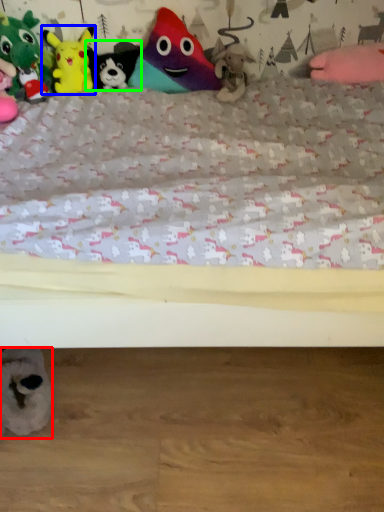
Question: Based on their relative distances, which object is nearer to toy (highlighted by a red box)? Choose from toy (highlighted by a blue box) and toy (highlighted by a green box).

Choices:
 (A) toy
 (B) toy

Answer: (A)